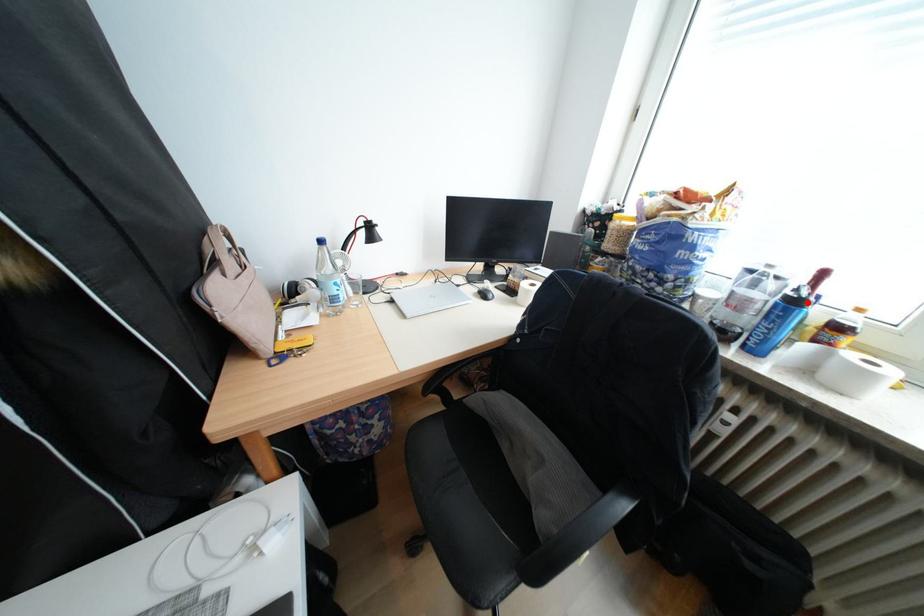
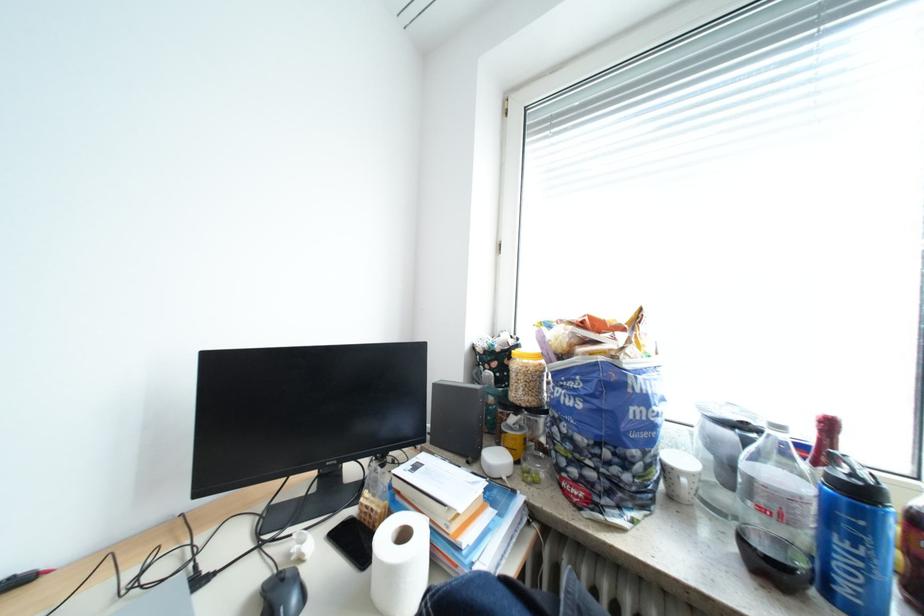
Question: A red point is marked in image1. In image2, is the corresponding 3D point closer to the camera or farther? Reply with the corresponding letter.

Choices:
 (A) The corresponding 3D point is closer.
 (B) The corresponding 3D point is farther.

Answer: (A)